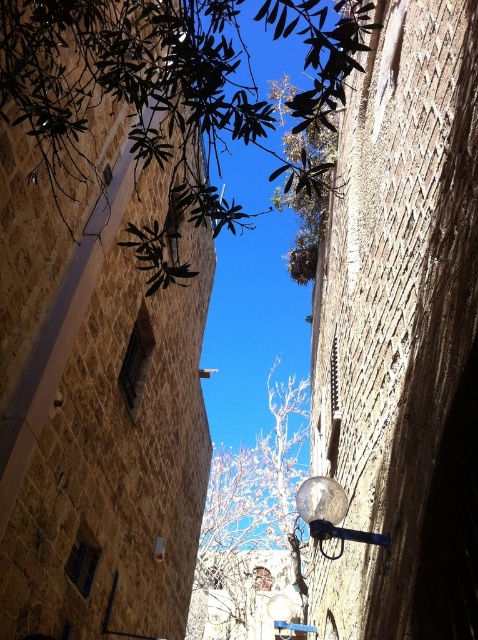
Question: Does green leafy tree at upper center appear on the left side of satin silver globe at center?

Choices:
 (A) no
 (B) yes

Answer: (B)

Question: Considering the real-world distances, which object is closest to the satin silver globe at center?

Choices:
 (A) bare branches at center
 (B) green leafy tree at upper center

Answer: (B)

Question: Can you confirm if green leafy tree at upper center is smaller than satin silver globe at center?

Choices:
 (A) yes
 (B) no

Answer: (B)

Question: Which point is closer to the camera?

Choices:
 (A) bare branches at center
 (B) satin silver globe at center

Answer: (B)

Question: In this image, where is green leafy tree at upper center located relative to satin silver globe at center?

Choices:
 (A) above
 (B) below

Answer: (A)

Question: Based on their relative distances, which object is nearer to the bare branches at center?

Choices:
 (A) green leafy tree at upper center
 (B) satin silver globe at center

Answer: (A)